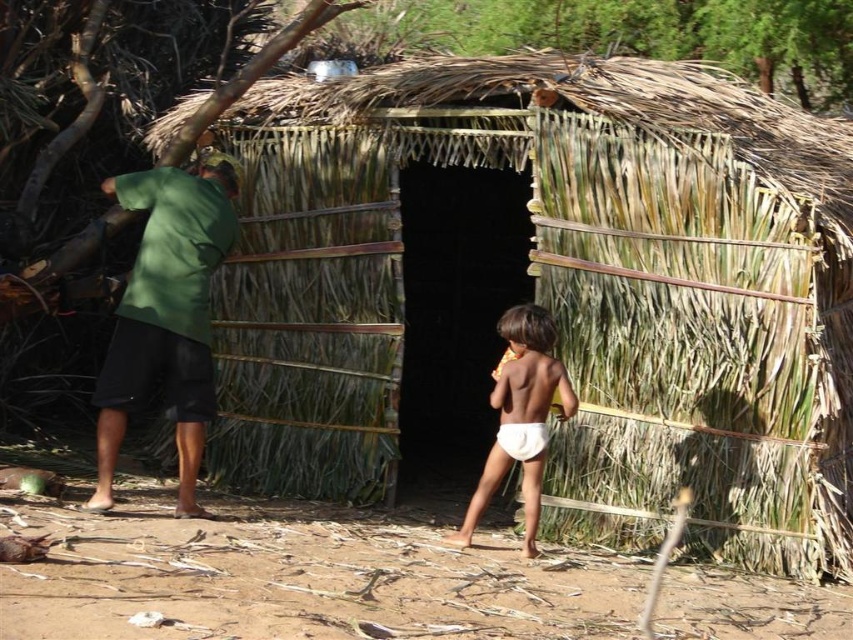
Between green fabric shirt at left and white cloth diaper at center, which one is positioned higher?

green fabric shirt at left

Does green fabric shirt at left have a larger size compared to white cloth diaper at center?

Indeed, green fabric shirt at left has a larger size compared to white cloth diaper at center.

Who is more forward, [196,184] or [508,428]?

Positioned in front is point [508,428].

Locate an element on the screen. This screenshot has width=853, height=640. green fabric shirt at left is located at coordinates (166, 314).

Is point (99, 417) closer to viewer compared to point (567, 412)?

No.

Is green fabric shirt at left shorter than white cloth at center?

No.

Is point (173, 225) in front of point (527, 384)?

No.

Identify the location of green fabric shirt at left. This screenshot has width=853, height=640. (x=166, y=314).

Is white cloth at center shorter than white cloth diaper at center?

No, white cloth at center is not shorter than white cloth diaper at center.

Is white cloth at center behind white cloth diaper at center?

No, it is not.

This screenshot has height=640, width=853. Identify the location of white cloth at center. (521, 417).